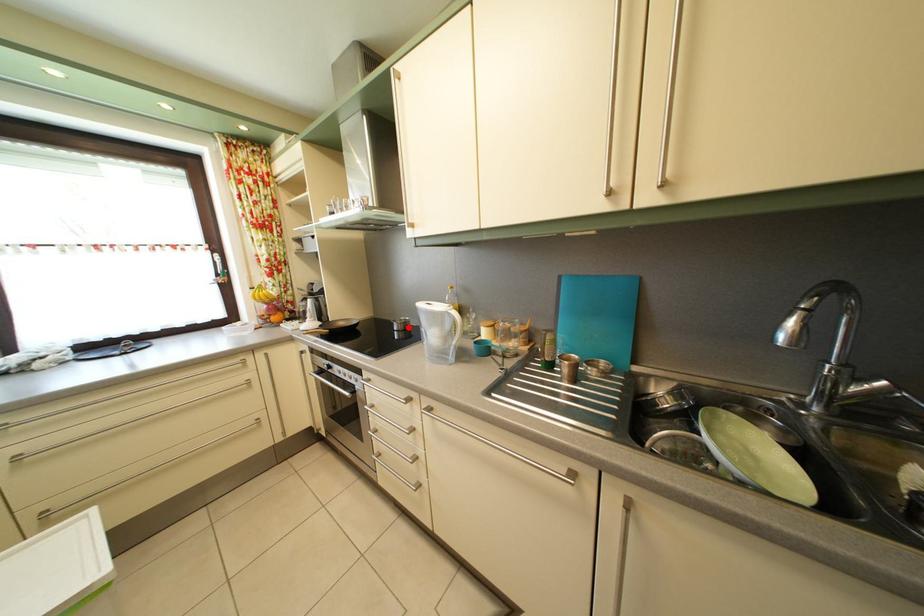
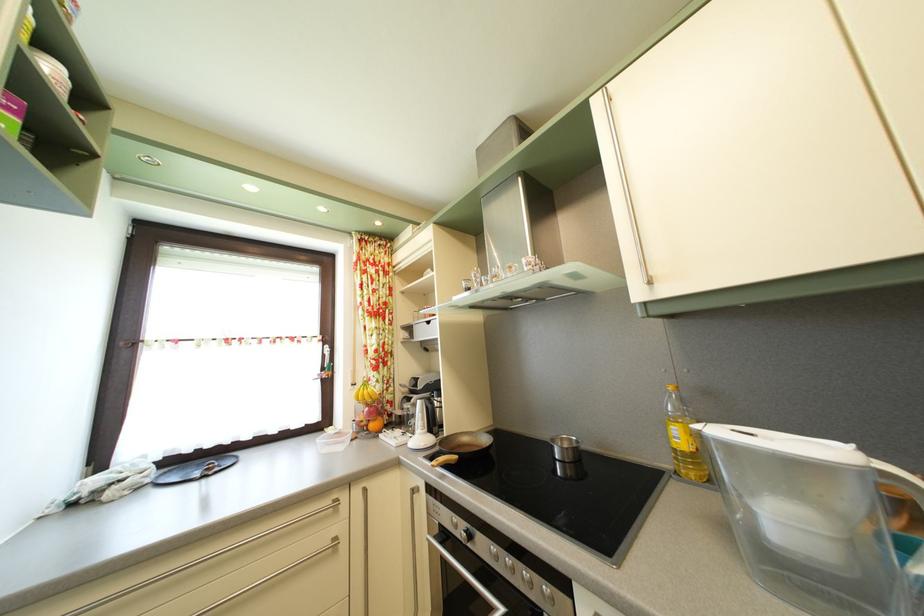
Find the pixel in the second image that matches the highlighted location in the first image.

(569, 448)